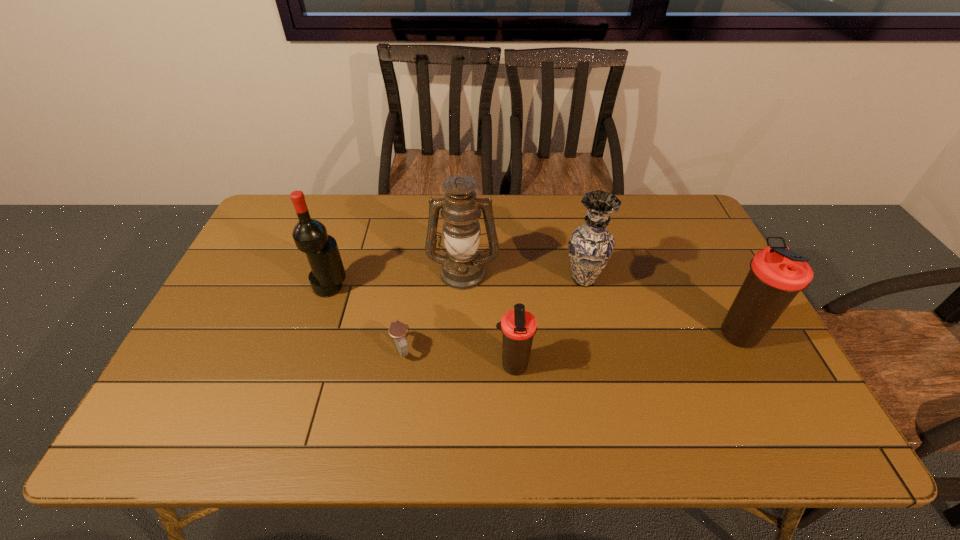
Find the location of a particular element. The width and height of the screenshot is (960, 540). vacant region located on the back of the right thermos bottle is located at coordinates (696, 247).

Locate an element on the screen. The image size is (960, 540). free region located 0.150m on the front of the vase is located at coordinates (597, 338).

Locate an element on the screen. vacant space situated on the front of the oil lamp is located at coordinates (460, 360).

Find the location of a particular element. This screenshot has width=960, height=540. free space located 0.120m on the right of the leftmost object is located at coordinates (390, 287).

Where is `vacant space located on the left of the watch`? This screenshot has width=960, height=540. vacant space located on the left of the watch is located at coordinates (238, 349).

The width and height of the screenshot is (960, 540). In order to click on object at the near edge in this screenshot , I will do `click(518, 326)`.

Where is `object present at the right edge`? This screenshot has height=540, width=960. object present at the right edge is located at coordinates (777, 274).

You are a GUI agent. You are given a task and a screenshot of the screen. Output one action in this format:
    pyautogui.click(x=<x>, y=<y>)
    Task: Click on the free space at the far edge of the desktop
    Image resolution: width=960 pixels, height=540 pixels.
    Given the screenshot: What is the action you would take?
    pyautogui.click(x=366, y=227)

You are a GUI agent. You are given a task and a screenshot of the screen. Output one action in this format:
    pyautogui.click(x=<x>, y=<y>)
    Task: Click on the free space at the near edge of the desktop
    
    Given the screenshot: What is the action you would take?
    click(596, 395)

Where is `vacant area at the left edge of the desktop`? vacant area at the left edge of the desktop is located at coordinates (257, 308).